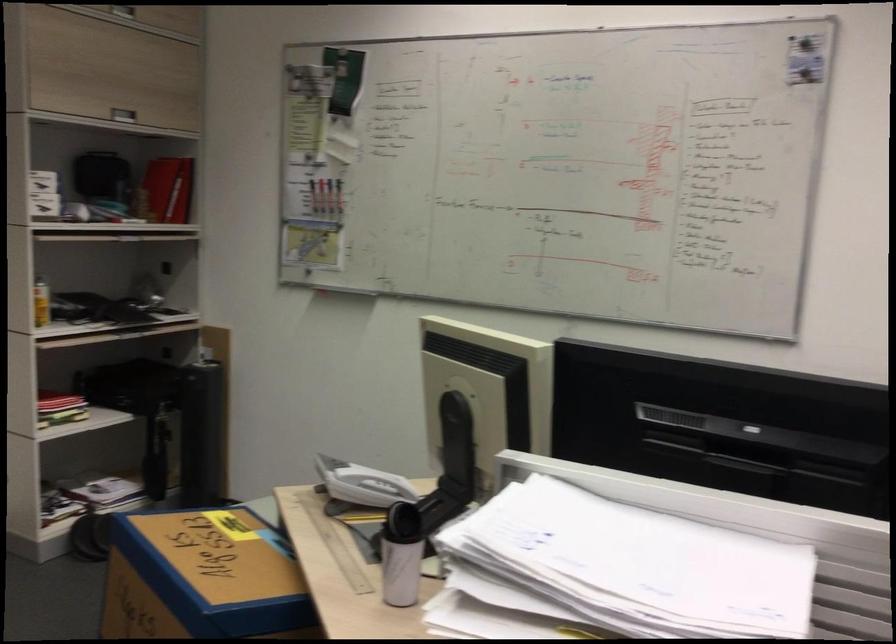
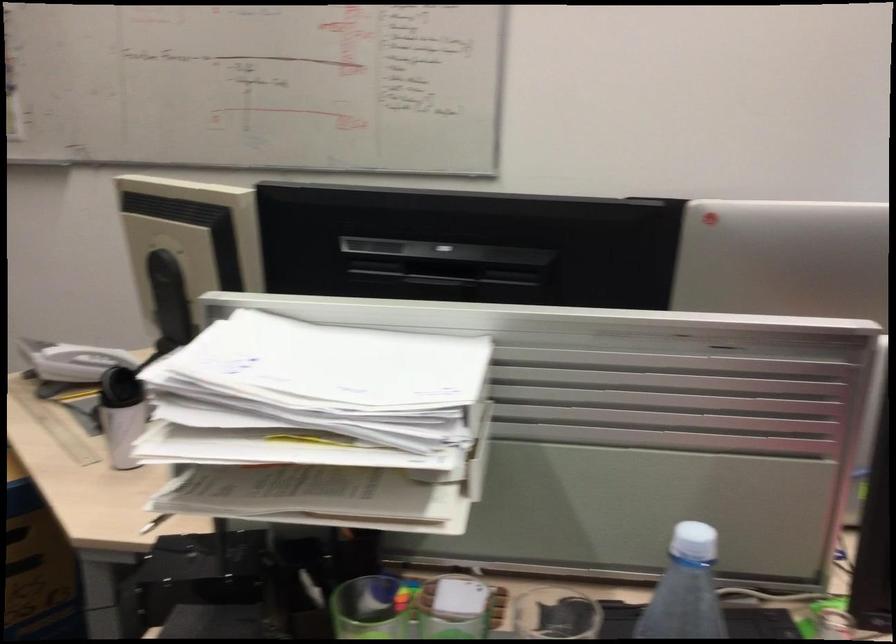
Locate, in the second image, the point that corresponds to point (636, 558) in the first image.

(333, 365)